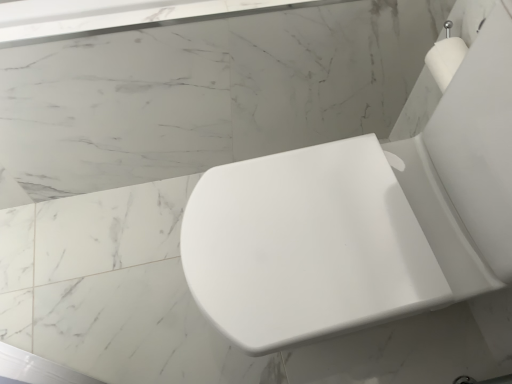
The image size is (512, 384). What do you see at coordinates (325, 242) in the screenshot? I see `white glossy toilet seat at center` at bounding box center [325, 242].

Where is `white glossy toilet seat at center`? white glossy toilet seat at center is located at coordinates (325, 242).

In order to face white glossy toilet seat at center, should I rotate leftwards or rightwards?

To align with it, rotate right about 14.480°.

This screenshot has height=384, width=512. Identify the location of white glossy toilet seat at center. (325, 242).